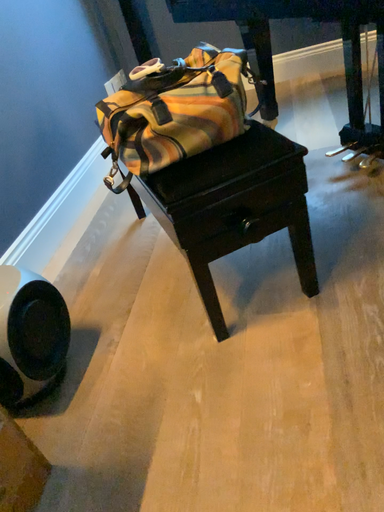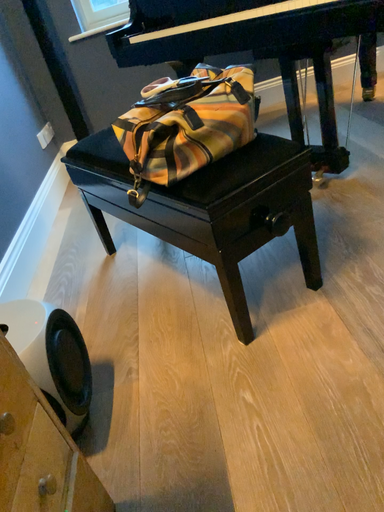
Question: Which way did the camera rotate in the video?

Choices:
 (A) rotated downward
 (B) rotated upward

Answer: (B)